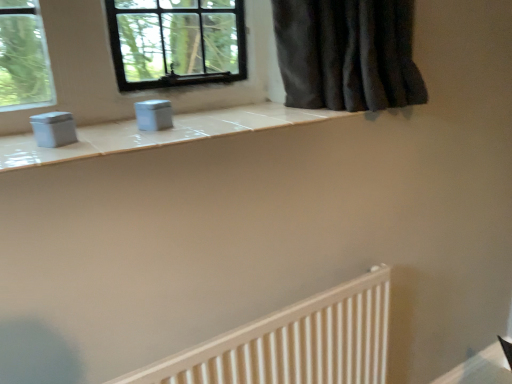
Question: Does point (369, 362) appear closer or farther from the camera than point (148, 114)?

Choices:
 (A) closer
 (B) farther

Answer: (B)

Question: Is white wooden radiator at lower right wider or thinner than matte plastic container at center?

Choices:
 (A) wide
 (B) thin

Answer: (A)

Question: Is white wooden radiator at lower right in front of or behind matte plastic container at center in the image?

Choices:
 (A) front
 (B) behind

Answer: (A)

Question: Is matte plastic container at center situated inside white wooden radiator at lower right or outside?

Choices:
 (A) outside
 (B) inside

Answer: (A)

Question: From the image's perspective, relative to white wooden radiator at lower right, is matte plastic container at center above or below?

Choices:
 (A) below
 (B) above

Answer: (B)

Question: Looking at the image, does matte plastic container at center seem bigger or smaller compared to white wooden radiator at lower right?

Choices:
 (A) big
 (B) small

Answer: (B)

Question: Is point (160, 117) closer or farther from the camera than point (350, 362)?

Choices:
 (A) farther
 (B) closer

Answer: (B)